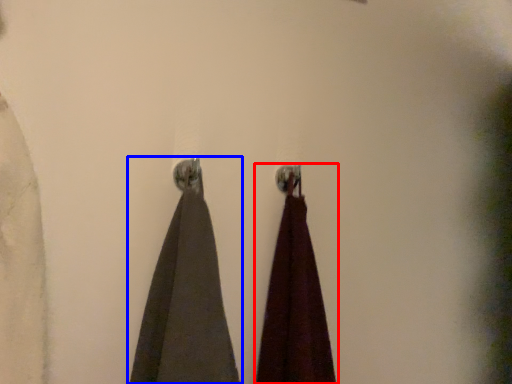
Question: Which object appears farthest to the camera in this image, curtain (highlighted by a red box) or curtain (highlighted by a blue box)?

Choices:
 (A) curtain
 (B) curtain

Answer: (A)